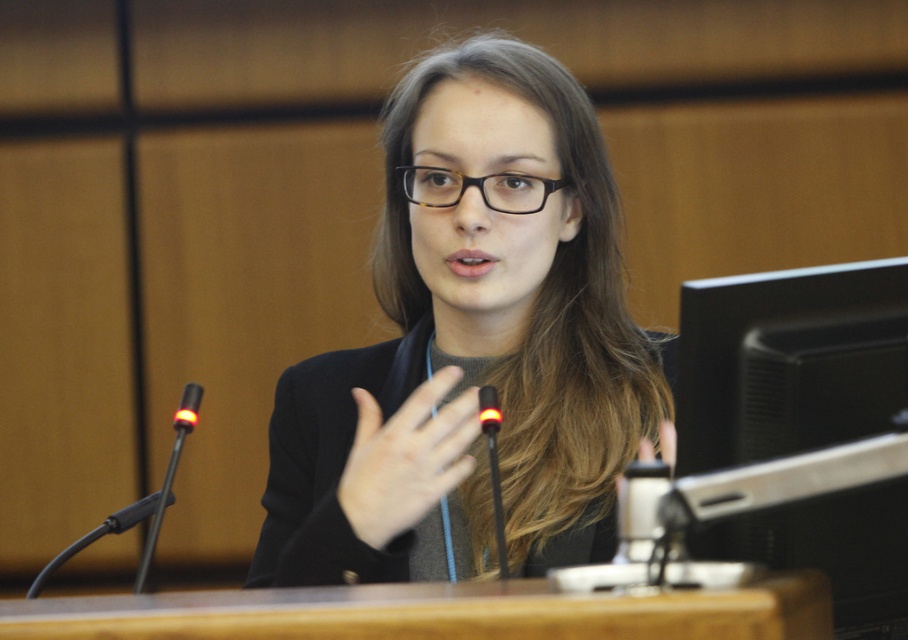
Can you confirm if black glossy monitor at right is wider than smooth skin hand at center?

Correct, the width of black glossy monitor at right exceeds that of smooth skin hand at center.

Identify the location of black glossy monitor at right. (788, 362).

Where is `black glossy monitor at right`? The width and height of the screenshot is (908, 640). black glossy monitor at right is located at coordinates (788, 362).

Is brown wood table at center positioned in front of black tortoiseshell glasses at center?

Yes, it is.

Does brown wood table at center appear over black tortoiseshell glasses at center?

No.

Who is more distant from viewer, (0, 636) or (435, 182)?

Positioned behind is point (435, 182).

In order to click on brown wood table at center in this screenshot , I will do `click(436, 612)`.

Can you confirm if black plastic microphone at left is wider than black plastic microphone at center?

Correct, the width of black plastic microphone at left exceeds that of black plastic microphone at center.

Which is behind, point (183, 419) or point (480, 397)?

The point (183, 419) is more distant.

Find the location of a particular element. The image size is (908, 640). black plastic microphone at left is located at coordinates (186, 408).